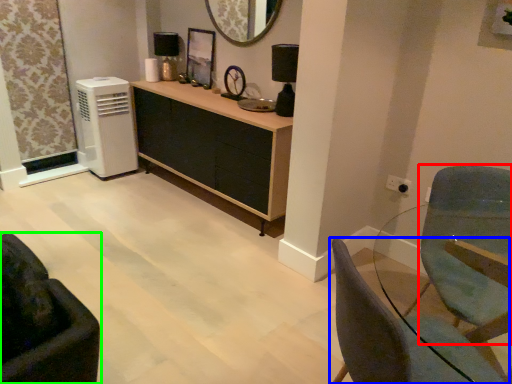
Question: Estimate the real-world distances between objects in this image. Which object is farther from swivel chair (highlighted by a red box), chair (highlighted by a blue box) or chair (highlighted by a green box)?

Choices:
 (A) chair
 (B) chair

Answer: (B)